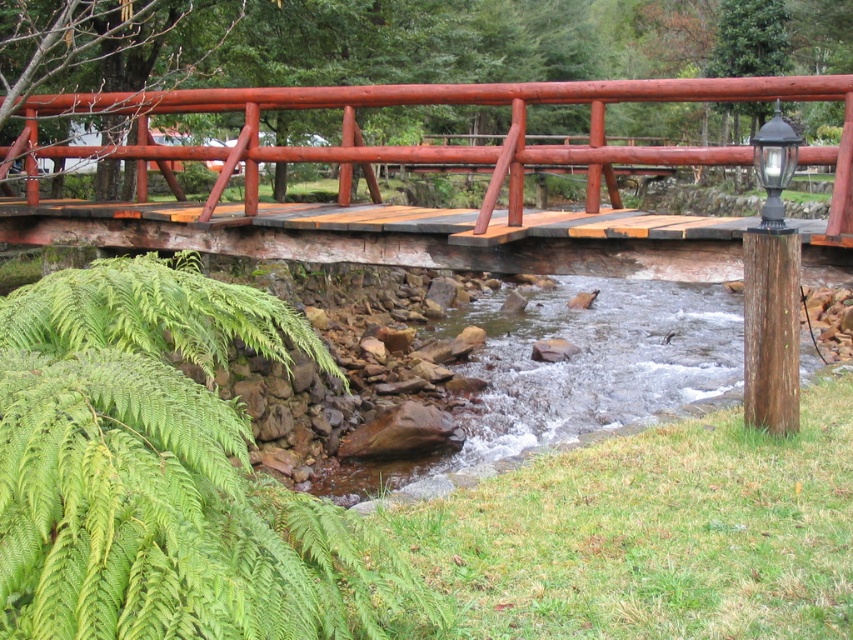
Is green leafy fern at lower left shorter than rustic wood bridge at center?

Correct, green leafy fern at lower left is not as tall as rustic wood bridge at center.

Based on the photo, who is positioned more to the right, green leafy fern at lower left or rustic wood bridge at center?

rustic wood bridge at center

Is point (117, 570) positioned after point (296, 156)?

No, it is not.

Locate an element on the screen. Image resolution: width=853 pixels, height=640 pixels. green leafy fern at lower left is located at coordinates (164, 472).

Does rustic wood bridge at center have a lesser height compared to black polished wood post at right?

→ Incorrect, rustic wood bridge at center's height does not fall short of black polished wood post at right's.

Who is shorter, rustic wood bridge at center or black polished wood post at right?

Standing shorter between the two is black polished wood post at right.

Between point (619, 93) and point (791, 381), which one is positioned behind?

Point (619, 93)

Identify the location of rustic wood bridge at center. (445, 145).

Does green leafy fern at lower left appear over black polished wood post at right?

No, green leafy fern at lower left is not above black polished wood post at right.

What do you see at coordinates (164, 472) in the screenshot?
I see `green leafy fern at lower left` at bounding box center [164, 472].

The height and width of the screenshot is (640, 853). Find the location of `green leafy fern at lower left`. green leafy fern at lower left is located at coordinates (164, 472).